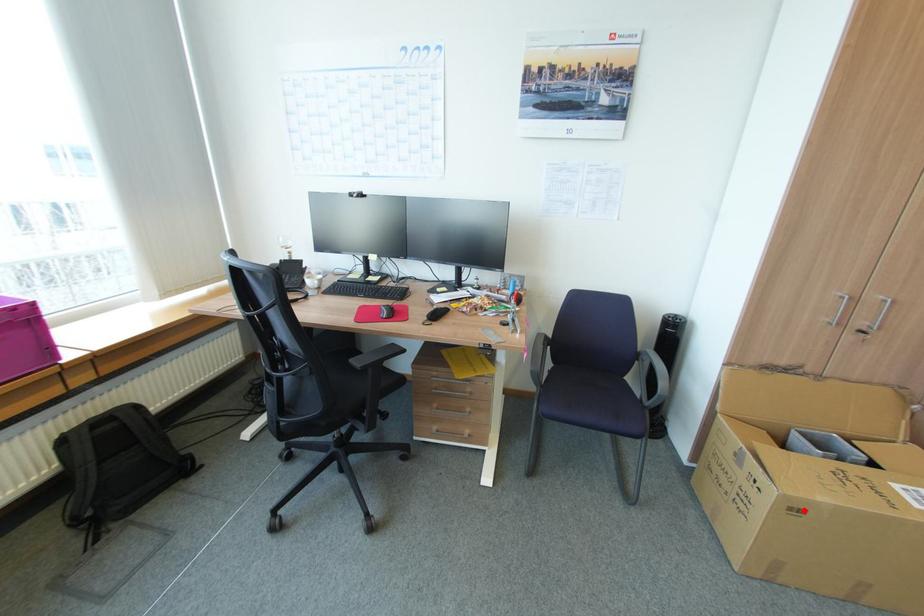
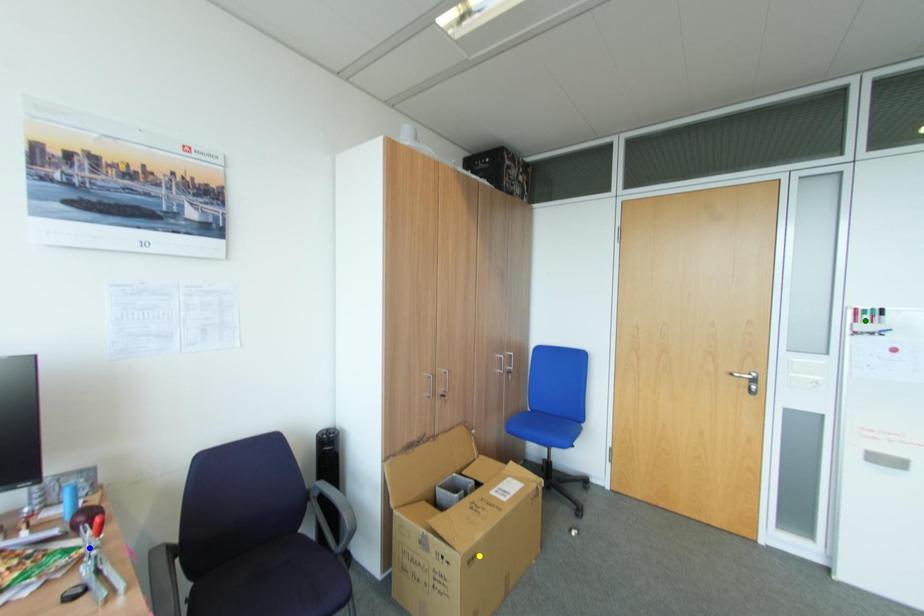
Question: I am providing you with two images of the same scene from different viewpoints. A red point is marked on the first image. You are given multiple points on the second image. Which spot in image 2 lines up with the point in image 1?

Choices:
 (A) green point
 (B) blue point
 (C) yellow point

Answer: (C)